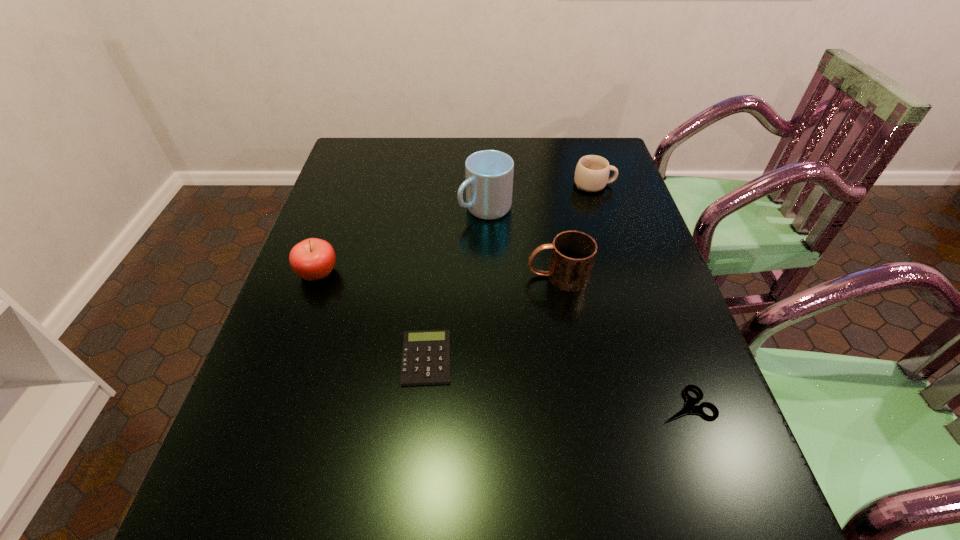
Point out which mug is positioned as the nearest to the leftmost object. Please provide its 2D coordinates. Your answer should be formatted as a tuple, i.e. [(x, y)], where the tuple contains the x and y coordinates of a point satisfying the conditions above.

[(489, 173)]

Choose which mug is the nearest neighbor to the shears. Please provide its 2D coordinates. Your answer should be formatted as a tuple, i.e. [(x, y)], where the tuple contains the x and y coordinates of a point satisfying the conditions above.

[(573, 253)]

This screenshot has width=960, height=540. Identify the location of free region that satisfies the following two spatial constraints: 1. on the side of the shears with the handle; 2. on the left side of the fourth tallest object. (663, 404).

In order to click on blank area in the image that satisfies the following two spatial constraints: 1. on the side of the fourth tallest object with the handle; 2. on the right side of the shears in this screenshot , I will do `click(663, 404)`.

Image resolution: width=960 pixels, height=540 pixels. I want to click on vacant space that satisfies the following two spatial constraints: 1. on the side of the nearest object with the handle; 2. on the right side of the second shortest mug, so click(580, 404).

Locate an element on the screen. Image resolution: width=960 pixels, height=540 pixels. free space in the image that satisfies the following two spatial constraints: 1. on the side of the second tallest mug with the handle; 2. on the front side of the second nearest object is located at coordinates (572, 359).